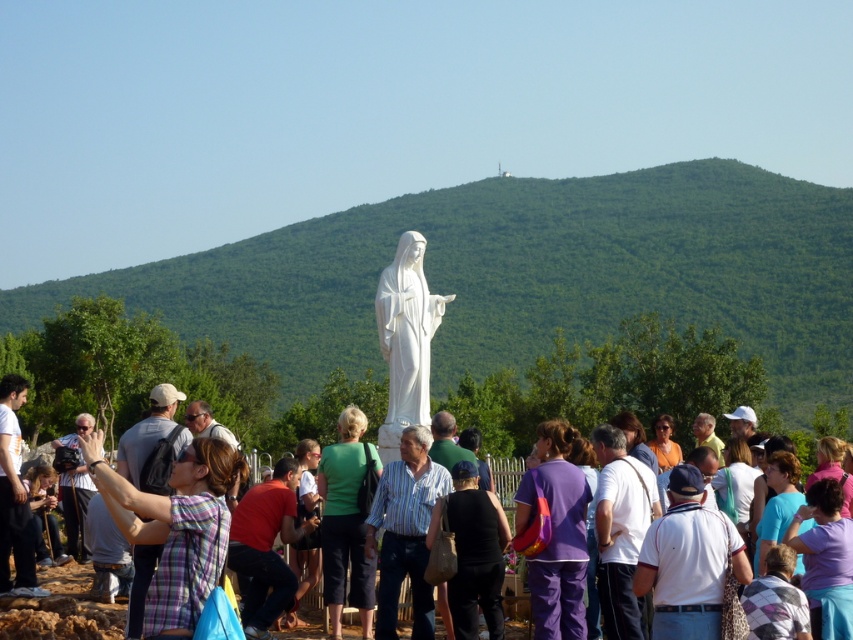
How far apart are green leafy hillside at center and white cotton shirt at center?

green leafy hillside at center is 81.86 meters from white cotton shirt at center.

Does green leafy hillside at center appear under white cotton shirt at center?

Incorrect, green leafy hillside at center is not positioned below white cotton shirt at center.

Which is in front, point (508, 205) or point (730, 513)?

Positioned in front is point (730, 513).

Where is `green leafy hillside at center`? green leafy hillside at center is located at coordinates (525, 275).

Can you confirm if green fabric shirt at center is wider than black fabric bag at center?

Correct, the width of green fabric shirt at center exceeds that of black fabric bag at center.

Which is behind, point (368, 605) or point (477, 605)?

The point (368, 605) is more distant.

I want to click on green fabric shirt at center, so click(345, 524).

Is purple fabric bag at center bigger than white marble statue at center?

Correct, purple fabric bag at center is larger in size than white marble statue at center.

Which is more to the right, purple fabric bag at center or white marble statue at center?

white marble statue at center is more to the right.

Find the location of a particular element. The width and height of the screenshot is (853, 640). purple fabric bag at center is located at coordinates (593, 397).